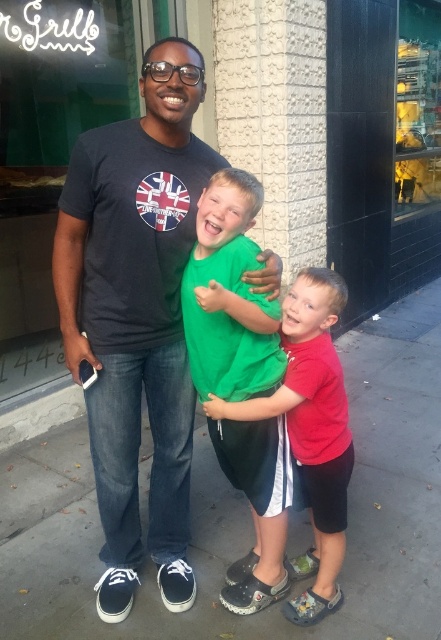
Question: Is green matte shirt at center to the right of red matte shirt at center from the viewer's perspective?

Choices:
 (A) no
 (B) yes

Answer: (A)

Question: Estimate the real-world distances between objects in this image. Which object is closer to the green matte shirt at center?

Choices:
 (A) dark gray t-shirt at center
 (B) red matte shirt at center
 (C) gray concrete sidewalk at center

Answer: (B)

Question: Can you confirm if dark gray t-shirt at center is thinner than red matte shirt at center?

Choices:
 (A) no
 (B) yes

Answer: (A)

Question: Estimate the real-world distances between objects in this image. Which object is closer to the dark gray t-shirt at center?

Choices:
 (A) gray concrete sidewalk at center
 (B) green matte shirt at center

Answer: (B)

Question: Which object is closer to the camera taking this photo?

Choices:
 (A) dark gray t-shirt at center
 (B) gray concrete sidewalk at center
 (C) green matte shirt at center

Answer: (C)

Question: Is dark gray t-shirt at center closer to the viewer compared to green matte shirt at center?

Choices:
 (A) yes
 (B) no

Answer: (B)